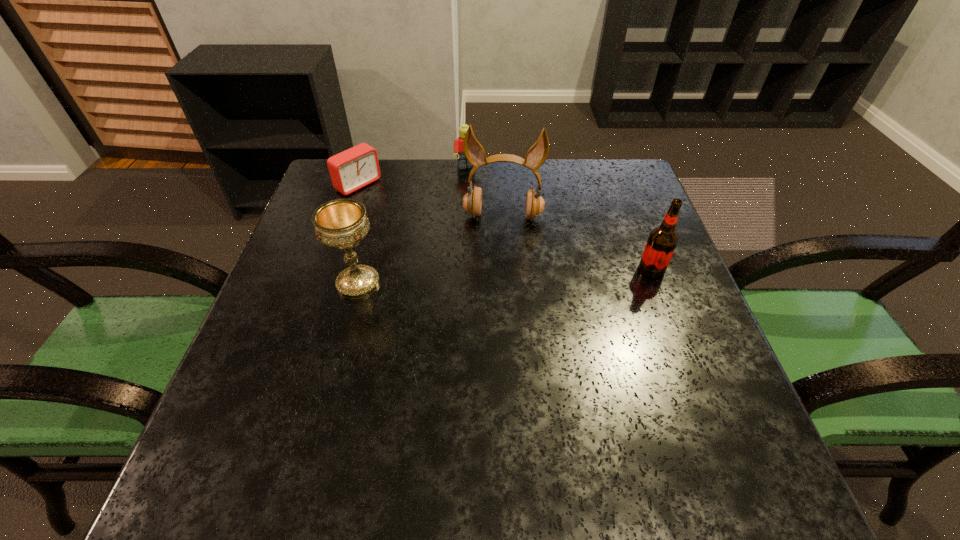
At what (x,y) coordinates should I click in order to perform the action: click on vacant region between the third farthest object and the second farthest object. Please return your answer as a coordinate pair (x, y). Looking at the image, I should click on (431, 201).

Identify the location of vacant area that lies between the fourth tallest object and the tallest object. (485, 192).

Point out which object is positioned as the nearest to the shortest object. Please provide its 2D coordinates. Your answer should be formatted as a tuple, i.e. [(x, y)], where the tuple contains the x and y coordinates of a point satisfying the conditions above.

[(462, 163)]

Select which object appears as the third closest to the Lego. Please provide its 2D coordinates. Your answer should be formatted as a tuple, i.e. [(x, y)], where the tuple contains the x and y coordinates of a point satisfying the conditions above.

[(341, 223)]

Where is `vacant space that satisfies the following two spatial constraints: 1. on the back side of the farthest object; 2. on the right side of the chalice`? This screenshot has width=960, height=540. vacant space that satisfies the following two spatial constraints: 1. on the back side of the farthest object; 2. on the right side of the chalice is located at coordinates (389, 167).

Locate an element on the screen. The height and width of the screenshot is (540, 960). vacant region that satisfies the following two spatial constraints: 1. on the back side of the fourth tallest object; 2. on the left side of the chalice is located at coordinates (389, 167).

You are a GUI agent. You are given a task and a screenshot of the screen. Output one action in this format:
    pyautogui.click(x=<x>, y=<y>)
    Task: Click on the free space that satisfies the following two spatial constraints: 1. on the back side of the rightmost object; 2. on the left side of the chalice
    This screenshot has width=960, height=540.
    Given the screenshot: What is the action you would take?
    pyautogui.click(x=362, y=269)

Locate an element on the screen. free space in the image that satisfies the following two spatial constraints: 1. on the back side of the Lego; 2. on the left side of the chalice is located at coordinates (389, 167).